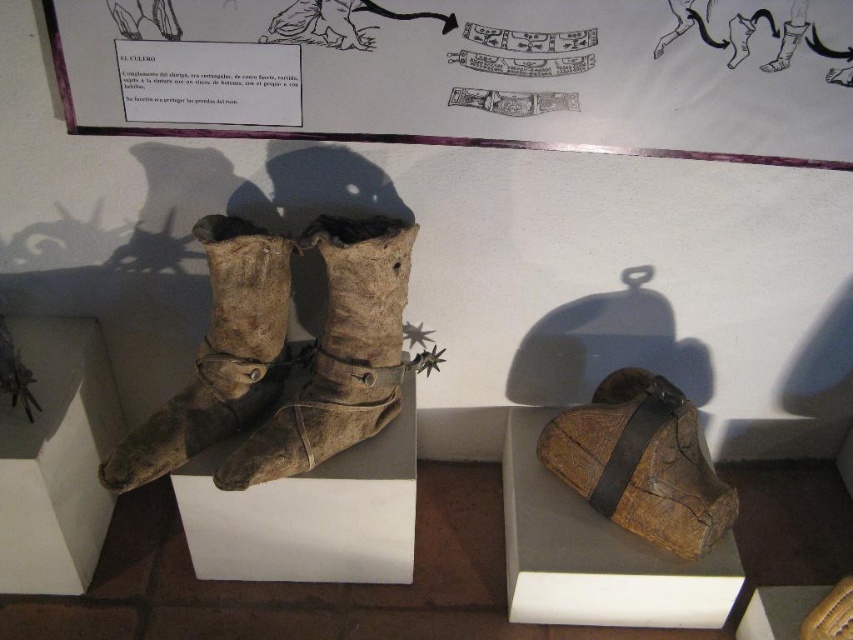
Question: From the image, what is the correct spatial relationship of brown leather boots at center in relation to brown leather boot at center?

Choices:
 (A) right
 (B) left

Answer: (A)

Question: Can you confirm if white paper bulletin board at upper center is positioned to the right of brown leather boot at center?

Choices:
 (A) no
 (B) yes

Answer: (B)

Question: Which object is farther from the camera taking this photo?

Choices:
 (A) brown leather boot at lower right
 (B) brown leather boot at center
 (C) brown leather boots at center
 (D) white paper bulletin board at upper center

Answer: (A)

Question: Which point is farther to the camera?

Choices:
 (A) (238, 257)
 (B) (0, 572)
 (C) (538, 118)

Answer: (B)

Question: Can you confirm if brown leather boots at center is smaller than brown leather box at lower left?

Choices:
 (A) yes
 (B) no

Answer: (B)

Question: Which object is positioned closest to the brown leather boot at lower right?

Choices:
 (A) brown leather boots at center
 (B) white paper bulletin board at upper center
 (C) worn leather boots at center

Answer: (A)